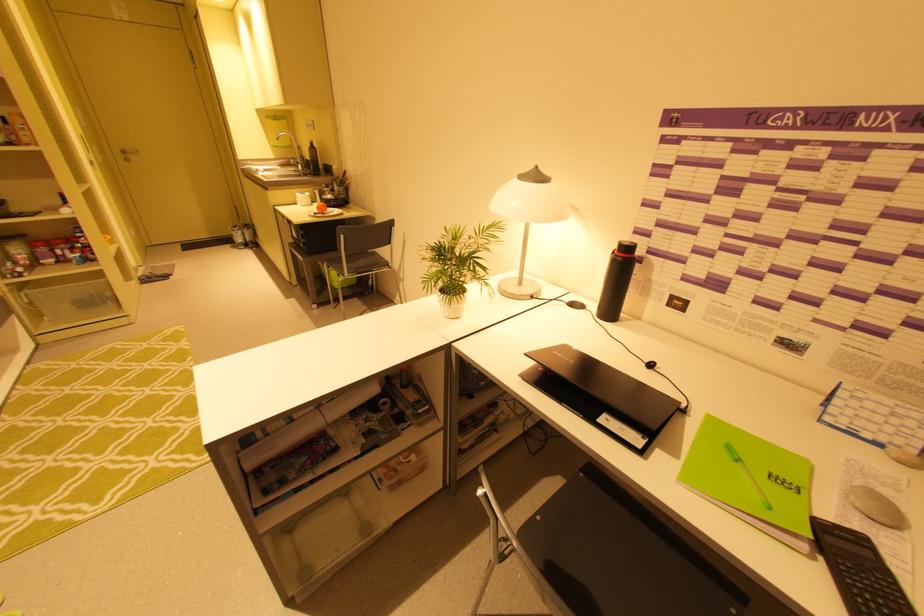
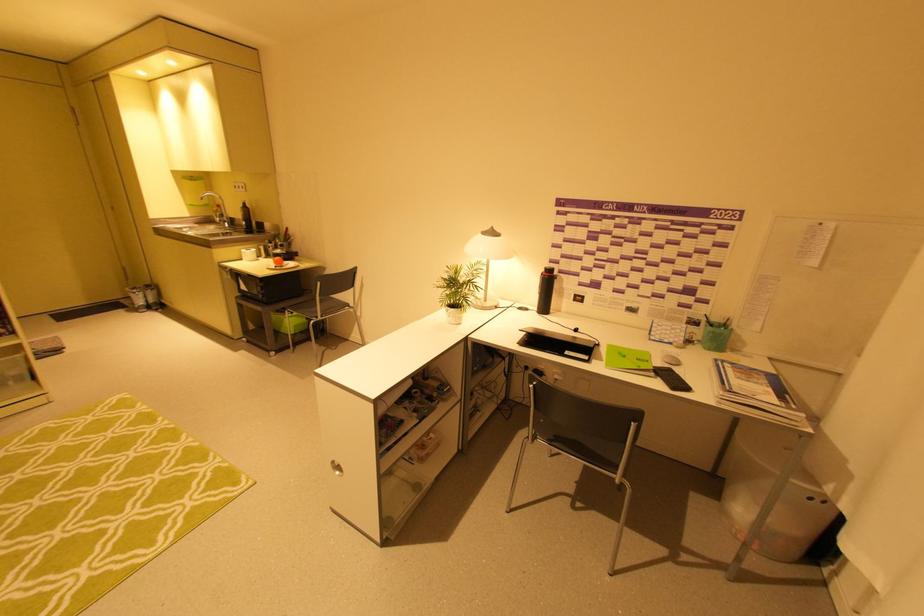
In the second image, find the point that corresponds to point 619,248 in the first image.

(546, 270)